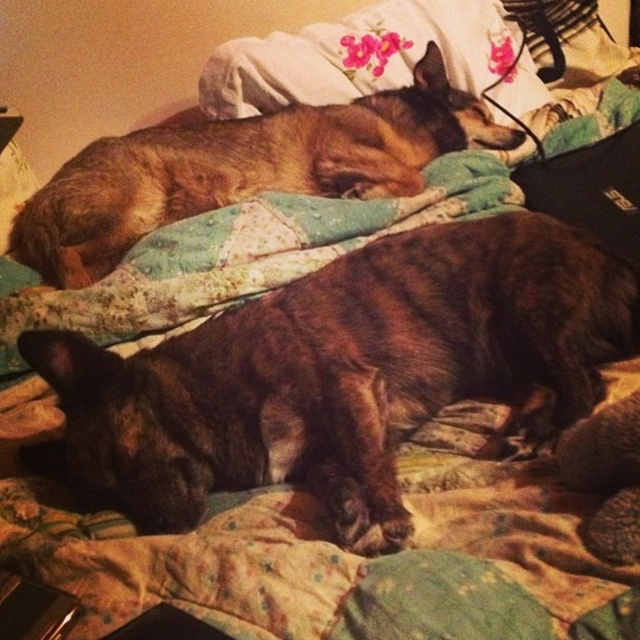
You are a photographer trying to capture a closeup of the brown fur dog at upper left. The camera you are using has a focal length of 50mm and an aperture of f2.8. The dog is positioned at coordinates point 0.264, 0.383. To ensure the dog is in focus, where should you adjust the focus point of your camera?

The focus point should be set to the coordinates point (244, 168) where the brown fur dog at upper left is located to ensure it is in focus.

You are standing in front of the bed and want to place a small toy between the cat and the dog. The cat is at point (200, 182) and the dog is at point (227, 100). Which point should you choose to place the toy so it is closer to the cat?

You should place the toy at point (200, 182) because it is closer to the cat than the dog.